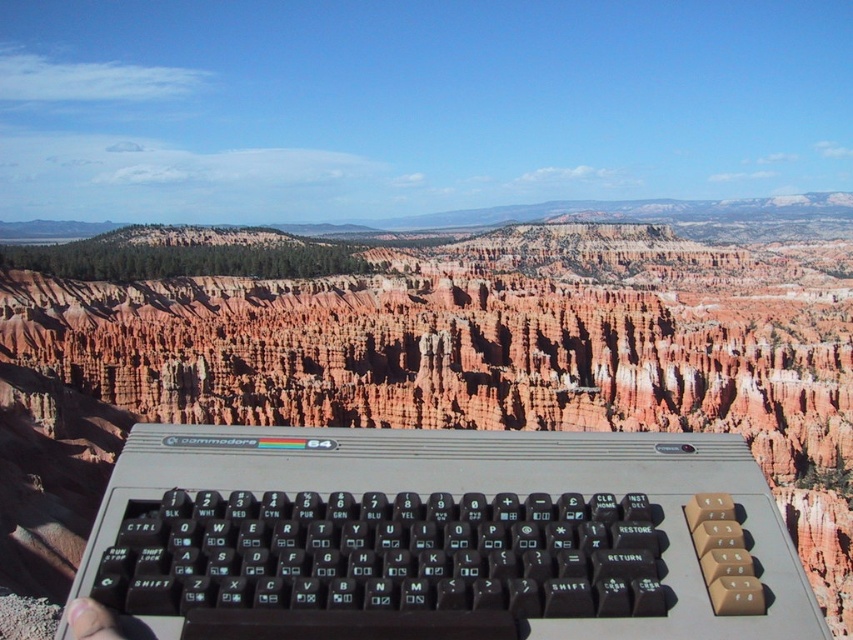
Question: Can you confirm if gray plastic keyboard at center is smaller than skinny flesh at lower left?

Choices:
 (A) no
 (B) yes

Answer: (A)

Question: Which of the following is the closest to the observer?

Choices:
 (A) (606, 472)
 (B) (91, 600)

Answer: (B)

Question: Does gray plastic keyboard at center have a smaller size compared to skinny flesh at lower left?

Choices:
 (A) no
 (B) yes

Answer: (A)

Question: Can you confirm if gray plastic keyboard at center is smaller than skinny flesh at lower left?

Choices:
 (A) no
 (B) yes

Answer: (A)

Question: Which point is farther to the camera?

Choices:
 (A) skinny flesh at lower left
 (B) gray plastic keyboard at center

Answer: (A)